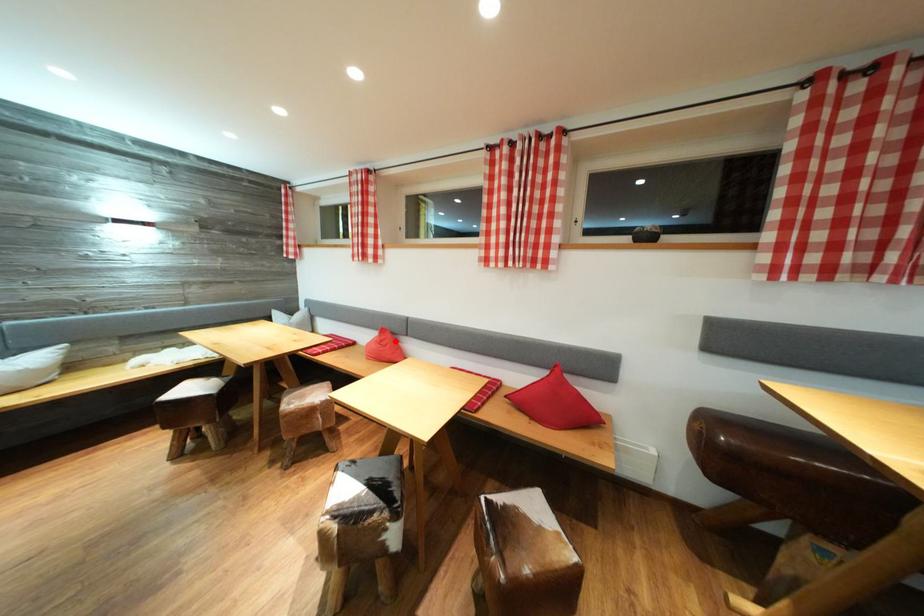
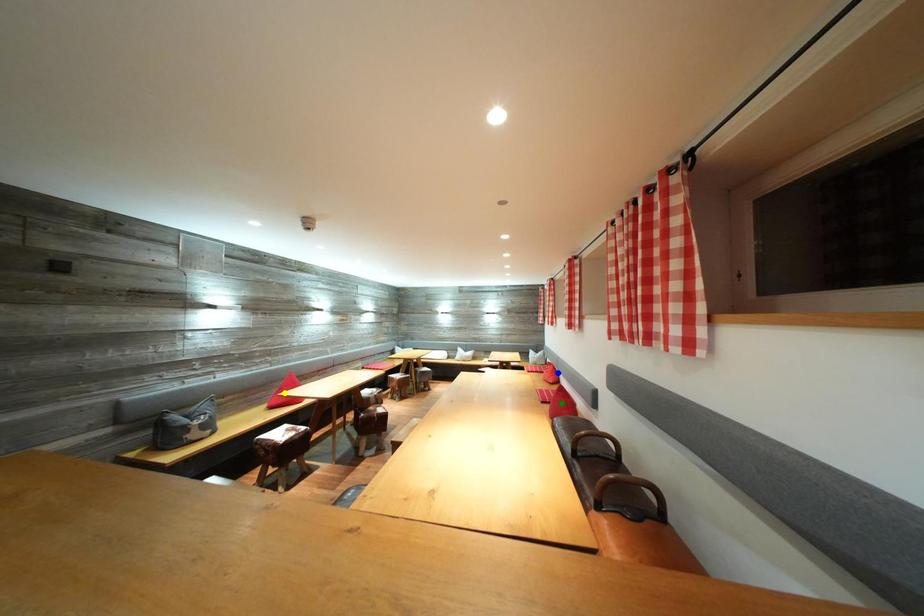
Question: I am providing you with two images of the same scene from different viewpoints. A red point is marked on the first image. You are given multiple points on the second image. Which spot in image 2 lines up with the point in image 1?

Choices:
 (A) yellow point
 (B) green point
 (C) blue point

Answer: (C)